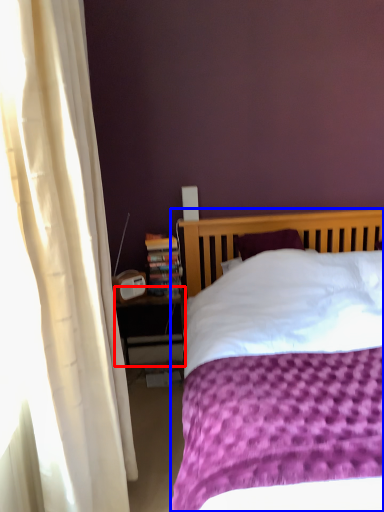
Question: Among these objects, which one is nearest to the camera, nightstand (highlighted by a red box) or bed (highlighted by a blue box)?

Choices:
 (A) nightstand
 (B) bed

Answer: (B)